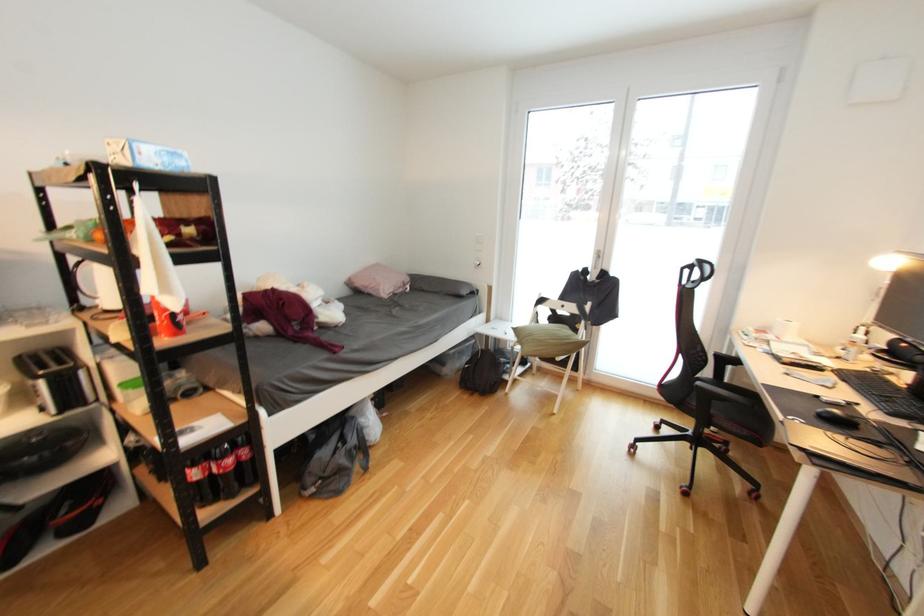
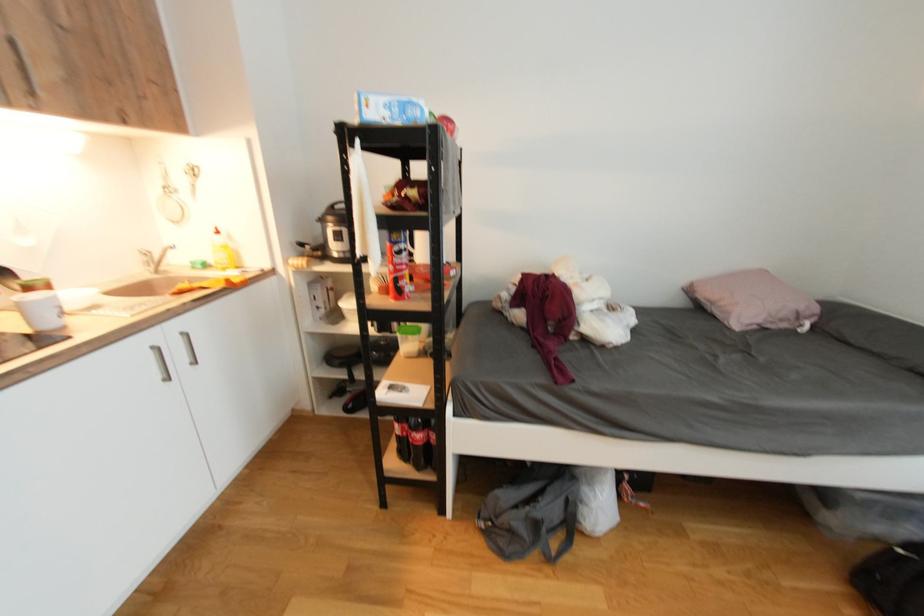
Question: How did the camera likely rotate?

Choices:
 (A) Left
 (B) Right
 (C) Up
 (D) Down

Answer: (A)